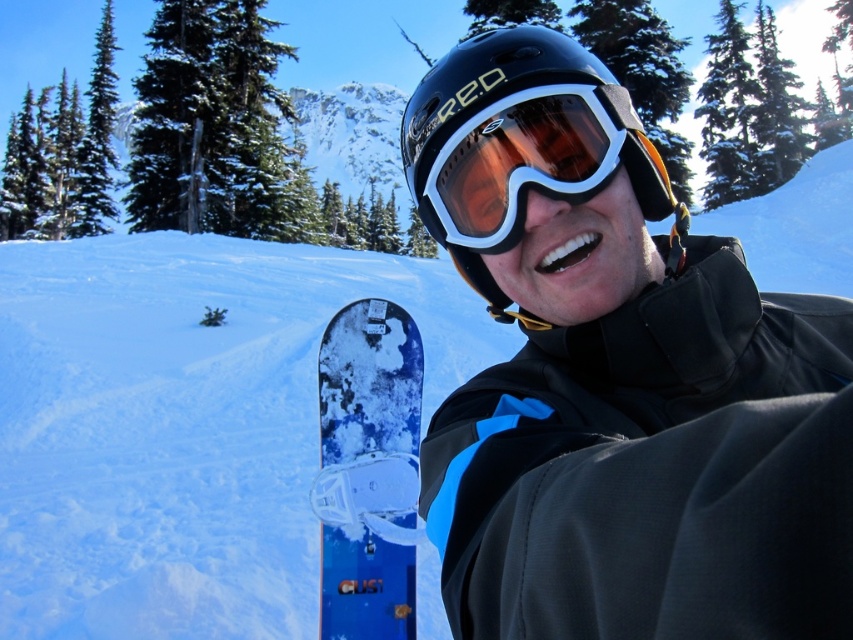
You are a snowboard instructor assessing the equipment of a student. The student has a black matte snowboard at center and a black matte helmet at center. Based on the scene, which equipment has a narrower width?

The black matte snowboard at center has a lesser width compared to the black matte helmet at center, so the snowboard is narrower.

You are a snowboarder preparing to take a photo of the snowboard with your camera. The camera is at your eye level, and you want to ensure the snowboard is in focus. Given that the camera is 1.45 meters away from the point where you want to focus, which is at coordinate point (514, 220), will the snowboard be in focus if the camera has a depth of field that can cover objects within 1.5 meters from the focus point?

The camera is 1.45 meters away from the focus point at (514, 220), which is within the 1.5 meters depth of field. Therefore, the snowboard will be in focus.